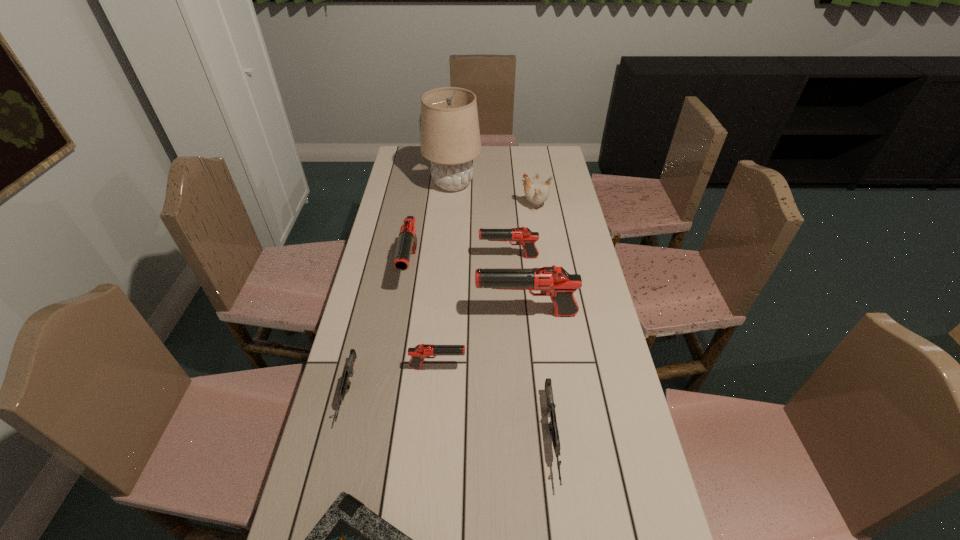
Identify the location of free space located 0.220m at the beak of the bird. This screenshot has height=540, width=960. (467, 206).

Locate an element on the screen. Image resolution: width=960 pixels, height=540 pixels. vacant space located at the aiming end of the third biggest black gun is located at coordinates (413, 257).

Find the location of `free region located at the aiming end of the third biggest black gun`. free region located at the aiming end of the third biggest black gun is located at coordinates (446, 257).

Where is `free space located 0.180m at the aiming end of the third biggest black gun`? free space located 0.180m at the aiming end of the third biggest black gun is located at coordinates [429, 257].

I want to click on vacant region located at the aiming end of the third shortest gun, so click(x=525, y=367).

At what (x,y) coordinates should I click in order to perform the action: click on free region located aimed along the barrel of the third shortest object. Please return your answer as a coordinate pair (x, y). Looking at the image, I should click on (564, 537).

I want to click on vacant space situated aimed along the barrel of the left grey gun, so click(333, 451).

At what (x,y) coordinates should I click in order to perform the action: click on object present at the far edge. Please return your answer as a coordinate pair (x, y). The image size is (960, 540). Looking at the image, I should click on (450, 137).

Find the location of a particular element. The height and width of the screenshot is (540, 960). lampshade that is at the left edge is located at coordinates (450, 137).

This screenshot has width=960, height=540. Identify the location of gun present at the right edge. (556, 282).